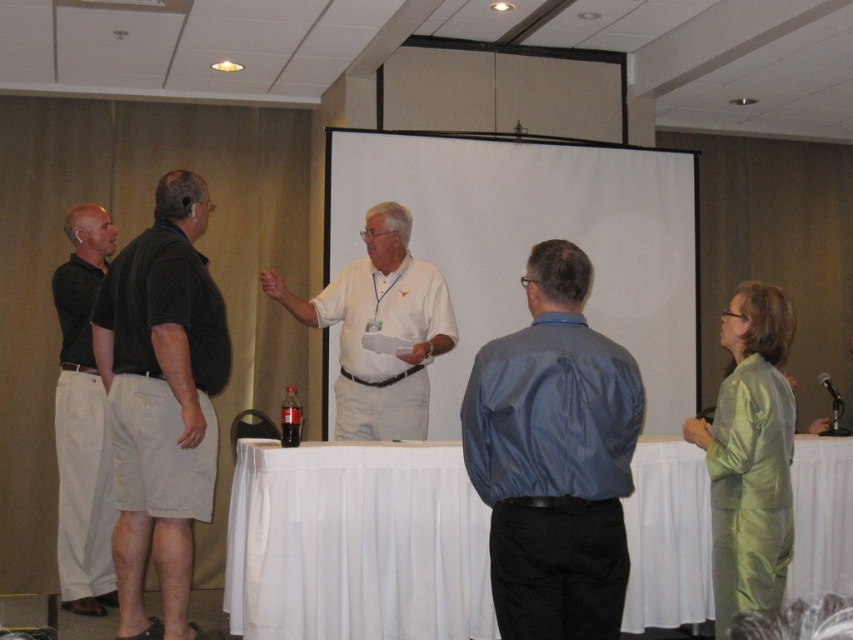
Question: Which object is farther from the camera taking this photo?

Choices:
 (A) white matte projection screen at center
 (B) blue satin shirt at center
 (C) dark green cotton shorts at left
 (D) green satin dress at right

Answer: (A)

Question: Which object is farther from the camera taking this photo?

Choices:
 (A) dark green cotton shorts at left
 (B) blue satin shirt at center

Answer: (A)

Question: Is white matte projection screen at center bigger than dark green shirt at left?

Choices:
 (A) yes
 (B) no

Answer: (A)

Question: Which of these objects is positioned closest to the green satin dress at right?

Choices:
 (A) dark green cotton shorts at left
 (B) dark green shirt at left

Answer: (A)

Question: Can you confirm if blue satin shirt at center is wider than dark green shirt at left?

Choices:
 (A) yes
 (B) no

Answer: (A)

Question: Is white matte shirt at center thinner than dark green shirt at left?

Choices:
 (A) no
 (B) yes

Answer: (A)